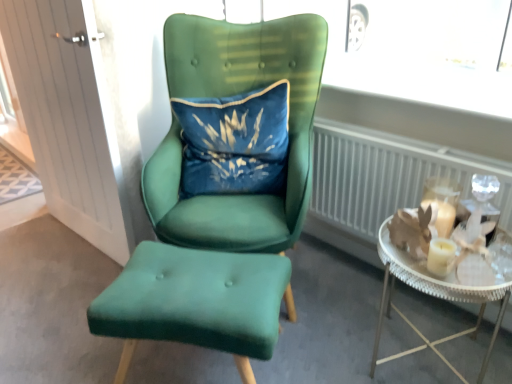
Question: From the image's perspective, is white metallic radiator at right positioned above or below velvet green chair at center, positioned as the first chair in top-to-bottom order?

Choices:
 (A) below
 (B) above

Answer: (A)

Question: From a real-world perspective, relative to velvet green chair at center, which appears as the second chair when ordered from the bottom, is white metallic radiator at right vertically above or below?

Choices:
 (A) below
 (B) above

Answer: (A)

Question: Estimate the real-world distances between objects in this image. Which object is farther from the white metallic radiator at right?

Choices:
 (A) velvet green chair at center, positioned as the first chair in top-to-bottom order
 (B) clear glass tray at right
 (C) velvet green ottoman at center, the first chair ordered from the bottom
 (D) velvet blue pillow at center
 (E) white wood door at left

Answer: (E)

Question: Estimate the real-world distances between objects in this image. Which object is closer to the metallic silver tray at right?

Choices:
 (A) white wood door at left
 (B) velvet green chair at center, positioned as the first chair in top-to-bottom order
 (C) velvet blue pillow at center
 (D) velvet green ottoman at center, positioned as the second chair in top-to-bottom order
 (E) clear glass tray at right

Answer: (E)